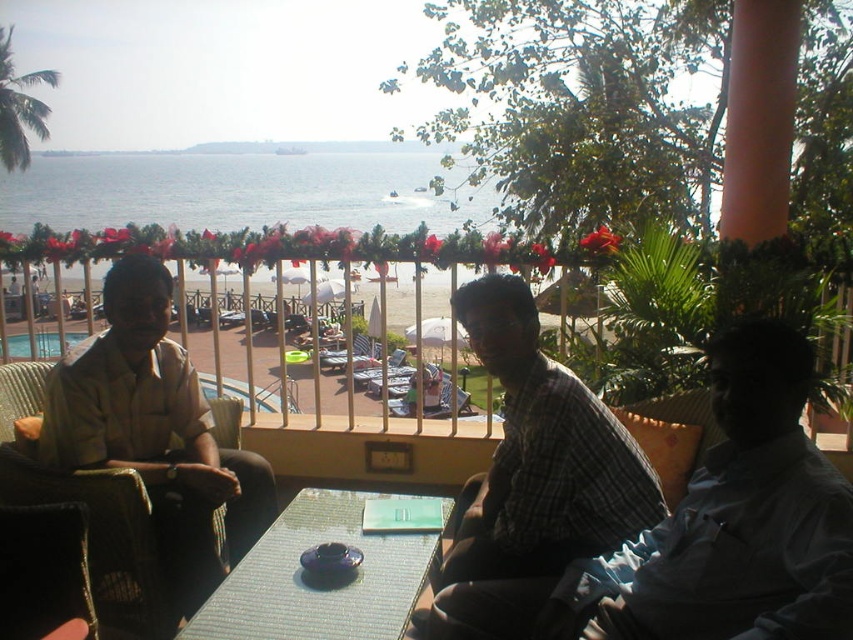
Does matte beige shirt at left have a greater height compared to translucent glass table at center?

Indeed, matte beige shirt at left has a greater height compared to translucent glass table at center.

This screenshot has height=640, width=853. I want to click on matte beige shirt at left, so click(x=155, y=433).

Is dark gray shirt at right to the left of translucent glass table at center from the viewer's perspective?

No, dark gray shirt at right is not to the left of translucent glass table at center.

Measure the distance between dark gray shirt at right and translucent glass table at center.

dark gray shirt at right is 26.85 inches from translucent glass table at center.

Does point (674, 529) come behind point (335, 605)?

No, it is in front of (335, 605).

Locate an element on the screen. The image size is (853, 640). dark gray shirt at right is located at coordinates (733, 524).

Is point (639, 637) positioned behind point (215, 582)?

No, it is not.

The height and width of the screenshot is (640, 853). Describe the element at coordinates (733, 524) in the screenshot. I see `dark gray shirt at right` at that location.

At what (x,y) coordinates should I click in order to perform the action: click on dark gray shirt at right. Please return your answer as a coordinate pair (x, y). The width and height of the screenshot is (853, 640). Looking at the image, I should click on (733, 524).